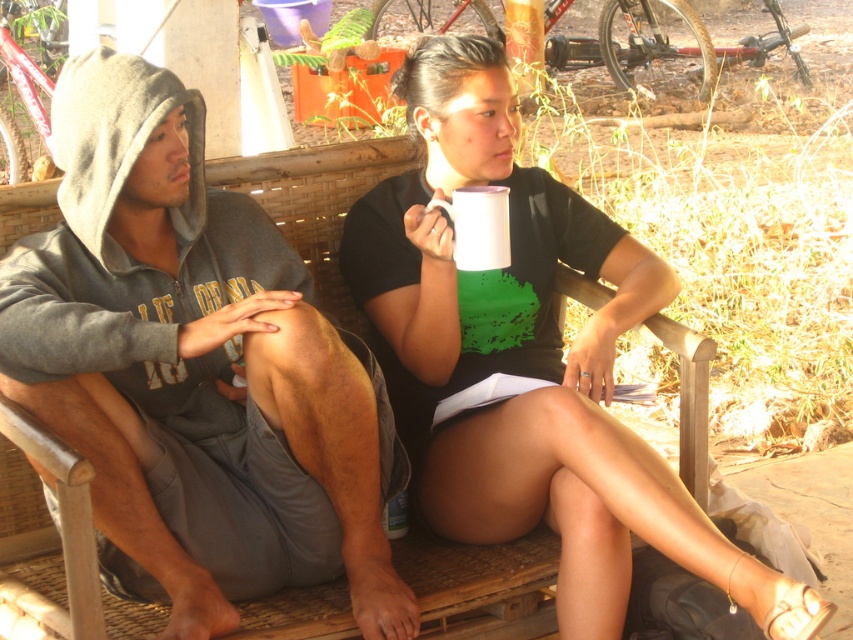
Can you confirm if gray fleece hoodie at left is shorter than white matte cup at center?

Yes.

Is gray fleece hoodie at left taller than white matte cup at center?

Incorrect, gray fleece hoodie at left's height is not larger of white matte cup at center's.

Who is more forward, (235,452) or (529,195)?

Point (235,452) is more forward.

Where is `gray fleece hoodie at left`? This screenshot has width=853, height=640. gray fleece hoodie at left is located at coordinates (195, 371).